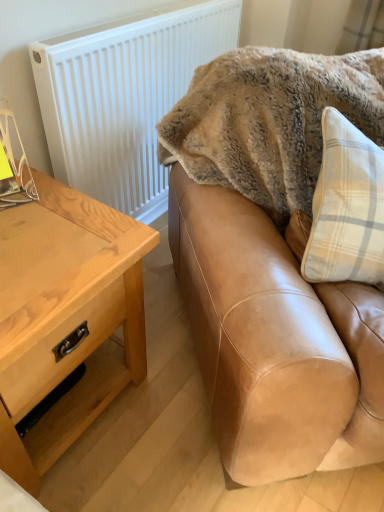
Question: Is light brown wood table at left looking in the opposite direction of fuzzy beige blanket at upper right?

Choices:
 (A) no
 (B) yes

Answer: (A)

Question: Is light brown wood table at left aimed at fuzzy beige blanket at upper right?

Choices:
 (A) no
 (B) yes

Answer: (A)

Question: From a real-world perspective, is light brown wood table at left over fuzzy beige blanket at upper right?

Choices:
 (A) yes
 (B) no

Answer: (B)

Question: Is light brown wood table at left completely or partially outside of fuzzy beige blanket at upper right?

Choices:
 (A) yes
 (B) no

Answer: (A)

Question: Are light brown wood table at left and fuzzy beige blanket at upper right beside each other?

Choices:
 (A) yes
 (B) no

Answer: (B)

Question: Considering the relative positions of white textured radiator at upper left and light brown wood table at left in the image provided, is white textured radiator at upper left to the left or to the right of light brown wood table at left?

Choices:
 (A) left
 (B) right

Answer: (B)

Question: In terms of height, does white textured radiator at upper left look taller or shorter compared to light brown wood table at left?

Choices:
 (A) short
 (B) tall

Answer: (B)

Question: From the image's perspective, is white textured radiator at upper left above or below light brown wood table at left?

Choices:
 (A) below
 (B) above

Answer: (B)

Question: Would you say white textured radiator at upper left is inside or outside light brown wood table at left?

Choices:
 (A) inside
 (B) outside

Answer: (B)

Question: Is tan leather couch at upper right taller or shorter than light brown wood table at left?

Choices:
 (A) tall
 (B) short

Answer: (A)

Question: From the image's perspective, is tan leather couch at upper right above or below light brown wood table at left?

Choices:
 (A) above
 (B) below

Answer: (A)

Question: From a real-world perspective, is tan leather couch at upper right above or below light brown wood table at left?

Choices:
 (A) above
 (B) below

Answer: (A)

Question: Considering the positions of tan leather couch at upper right and light brown wood table at left in the image, is tan leather couch at upper right wider or thinner than light brown wood table at left?

Choices:
 (A) wide
 (B) thin

Answer: (A)

Question: Is tan leather couch at upper right inside the boundaries of fuzzy beige blanket at upper right, or outside?

Choices:
 (A) outside
 (B) inside

Answer: (A)

Question: From the image's perspective, relative to fuzzy beige blanket at upper right, is tan leather couch at upper right above or below?

Choices:
 (A) below
 (B) above

Answer: (A)